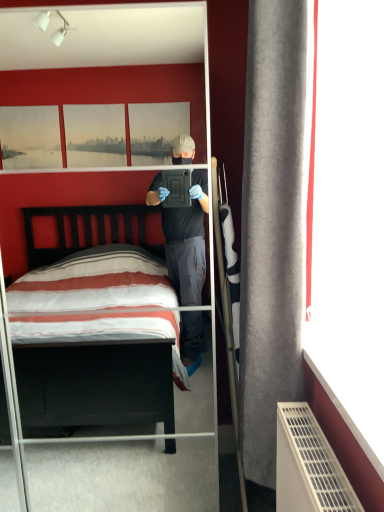
What do you see at coordinates (135, 464) in the screenshot?
I see `clear glass mirror at center` at bounding box center [135, 464].

Image resolution: width=384 pixels, height=512 pixels. In order to click on clear glass mirror at center in this screenshot , I will do `click(135, 464)`.

Find the location of a particular element. Image resolution: width=384 pixels, height=512 pixels. gray fabric curtain at right is located at coordinates (272, 226).

Measure the distance between gray fabric curtain at right and camera.

gray fabric curtain at right and camera are 1.18 meters apart.

Describe the element at coordinates (272, 226) in the screenshot. I see `gray fabric curtain at right` at that location.

Locate an element on the screen. The height and width of the screenshot is (512, 384). clear glass mirror at center is located at coordinates (135, 464).

Visually, is clear glass mirror at center positioned to the left or to the right of gray fabric curtain at right?

Clearly, clear glass mirror at center is on the left of gray fabric curtain at right in the image.

Is clear glass mirror at center closer to the viewer compared to gray fabric curtain at right?

No, it is behind gray fabric curtain at right.

Does point (196, 455) lie behind point (292, 268)?

Yes, it is.

From the image's perspective, is clear glass mirror at center located above or below gray fabric curtain at right?

clear glass mirror at center is below gray fabric curtain at right.

From a real-world perspective, relative to gray fabric curtain at right, is clear glass mirror at center vertically above or below?

From a real-world perspective, clear glass mirror at center is physically below gray fabric curtain at right.

Does clear glass mirror at center have a lesser width compared to gray fabric curtain at right?

In fact, clear glass mirror at center might be wider than gray fabric curtain at right.

Is clear glass mirror at center taller or shorter than gray fabric curtain at right?

In the image, clear glass mirror at center appears to be taller than gray fabric curtain at right.

Between clear glass mirror at center and gray fabric curtain at right, which one has smaller size?

Smaller between the two is gray fabric curtain at right.

Which is correct: clear glass mirror at center is inside gray fabric curtain at right, or outside of it?

clear glass mirror at center is not enclosed by gray fabric curtain at right.

Is clear glass mirror at center with gray fabric curtain at right?

clear glass mirror at center is not next to gray fabric curtain at right, and they're not touching.

Is gray fabric curtain at right at the back of clear glass mirror at center?

No, clear glass mirror at center is not facing the opposite direction of gray fabric curtain at right.

How distant is clear glass mirror at center from gray fabric curtain at right?

A distance of 4.21 feet exists between clear glass mirror at center and gray fabric curtain at right.

There is a clear glass mirror at center. Find the location of `curtain above it (from a real-world perspective)`. curtain above it (from a real-world perspective) is located at coordinates (272, 226).

Which is more to the left, gray fabric curtain at right or clear glass mirror at center?

clear glass mirror at center.

Is gray fabric curtain at right in front of or behind clear glass mirror at center in the image?

gray fabric curtain at right is in front of clear glass mirror at center.

Which is closer to the camera, (264, 254) or (180, 401)?

Point (264, 254) appears to be closer to the viewer than point (180, 401).

From the image's perspective, which one is positioned lower, gray fabric curtain at right or clear glass mirror at center?

From the image's view, clear glass mirror at center is below.

From a real-world perspective, is gray fabric curtain at right positioned over clear glass mirror at center based on gravity?

Yes, from a real-world perspective, gray fabric curtain at right is above clear glass mirror at center.

Which of these two, gray fabric curtain at right or clear glass mirror at center, is wider?

With larger width is clear glass mirror at center.

Does gray fabric curtain at right have a lesser height compared to clear glass mirror at center?

Yes, gray fabric curtain at right is shorter than clear glass mirror at center.

Considering the relative sizes of gray fabric curtain at right and clear glass mirror at center in the image provided, is gray fabric curtain at right smaller than clear glass mirror at center?

Correct, gray fabric curtain at right occupies less space than clear glass mirror at center.

Is gray fabric curtain at right spatially inside clear glass mirror at center, or outside of it?

The correct answer is: outside.

Are gray fabric curtain at right and clear glass mirror at center making contact?

gray fabric curtain at right and clear glass mirror at center are not in contact.

Is gray fabric curtain at right facing away from clear glass mirror at center?

No.

What's the angular difference between gray fabric curtain at right and clear glass mirror at center's facing directions?

There is a 88.7-degree angle between the facing directions of gray fabric curtain at right and clear glass mirror at center.

Measure the distance from gray fabric curtain at right to clear glass mirror at center.

4.21 feet.

Where is `curtain lying in front of the clear glass mirror at center`? curtain lying in front of the clear glass mirror at center is located at coordinates (272, 226).

Identify the location of mirror on the left of the gray fabric curtain at right. (135, 464).

You are a GUI agent. You are given a task and a screenshot of the screen. Output one action in this format:
    pyautogui.click(x=<x>, y=<y>)
    Task: Click on the curtain that is above the clear glass mirror at center (from a real-world perspective)
    The height and width of the screenshot is (512, 384).
    Given the screenshot: What is the action you would take?
    pyautogui.click(x=272, y=226)